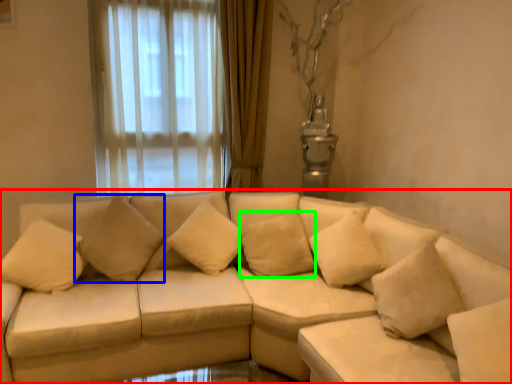
Question: Which is nearer to the studio couch (highlighted by a red box)? pillow (highlighted by a blue box) or pillow (highlighted by a green box).

Choices:
 (A) pillow
 (B) pillow

Answer: (B)